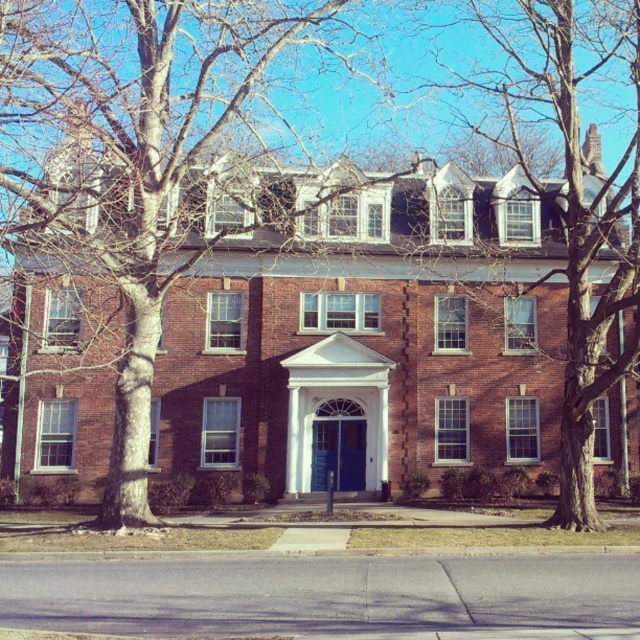
You are standing in front of the two story brick building and see the bare bark tree at center and the bare wood tree at upper right. Which tree is closer to you?

The bare bark tree at center is closer to you because it is in front of the bare wood tree at upper right.

You are a landscape architect planning to install a new walkway between the two trees. The walkway requires a minimum clearance of 30 feet between the trees to accommodate a decorative fountain. Based on the scene, will the existing distance between the bare bark tree at center and the bare wood tree at upper right allow for this installation?

The distance between the bare bark tree at center and the bare wood tree at upper right is 29.62 feet, which is slightly less than the required 30 feet clearance. Therefore, the walkway with the fountain cannot be installed as the existing space is insufficient.